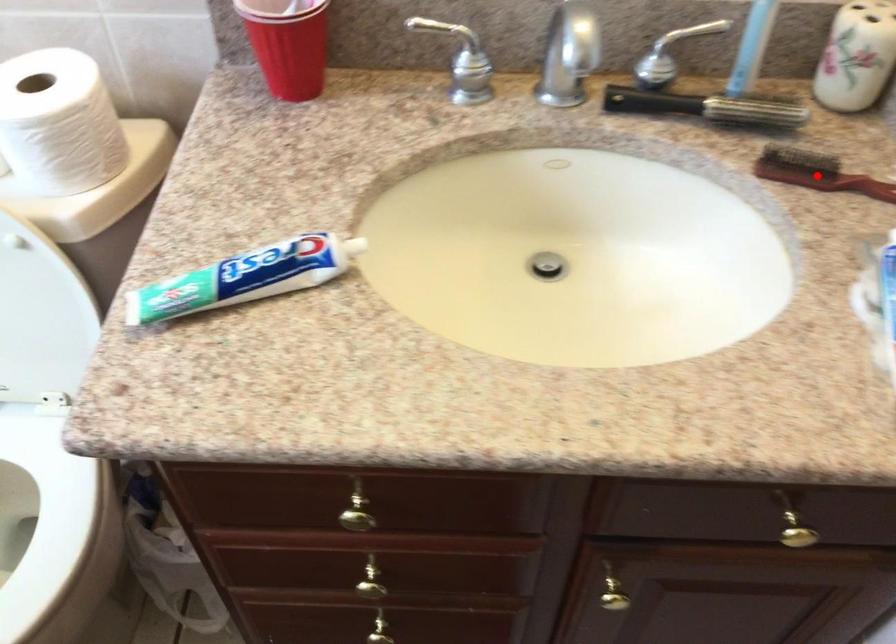
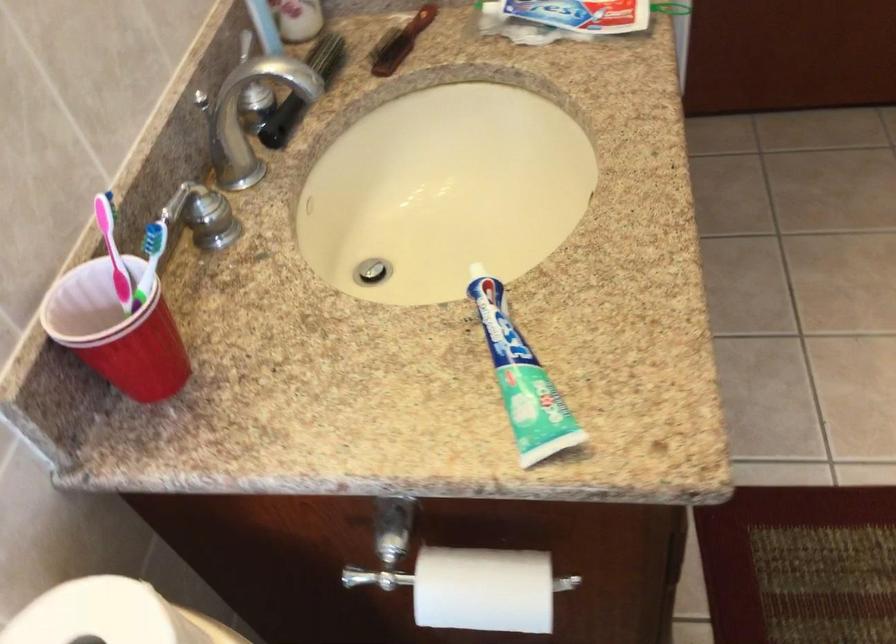
In the second image, find the point that corresponds to the highlighted location in the first image.

(400, 42)